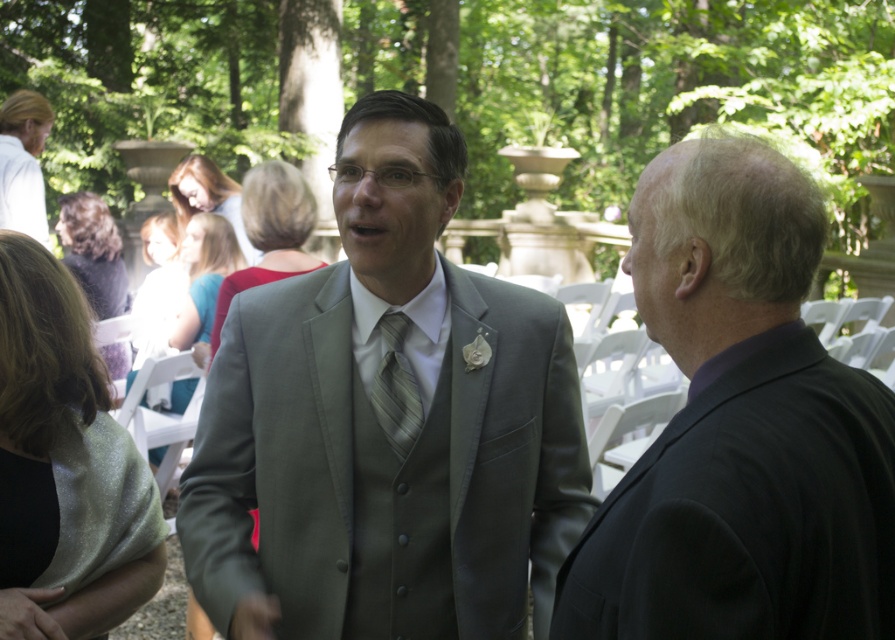
Question: Which point appears closest to the camera in this image?

Choices:
 (A) (418, 403)
 (B) (382, 538)

Answer: (B)

Question: Estimate the real-world distances between objects in this image. Which object is farther from the dark purple suit at right?

Choices:
 (A) striped silk tie at center
 (B) matte gray suit at center

Answer: (A)

Question: Does dark purple suit at right have a greater width compared to striped silk tie at center?

Choices:
 (A) no
 (B) yes

Answer: (B)

Question: Is matte gray suit at center above dark purple suit at right?

Choices:
 (A) no
 (B) yes

Answer: (B)

Question: Can you confirm if dark purple suit at right is positioned to the left of striped silk tie at center?

Choices:
 (A) yes
 (B) no

Answer: (B)

Question: Which point is farther to the camera?

Choices:
 (A) dark purple suit at right
 (B) matte gray suit at center

Answer: (B)